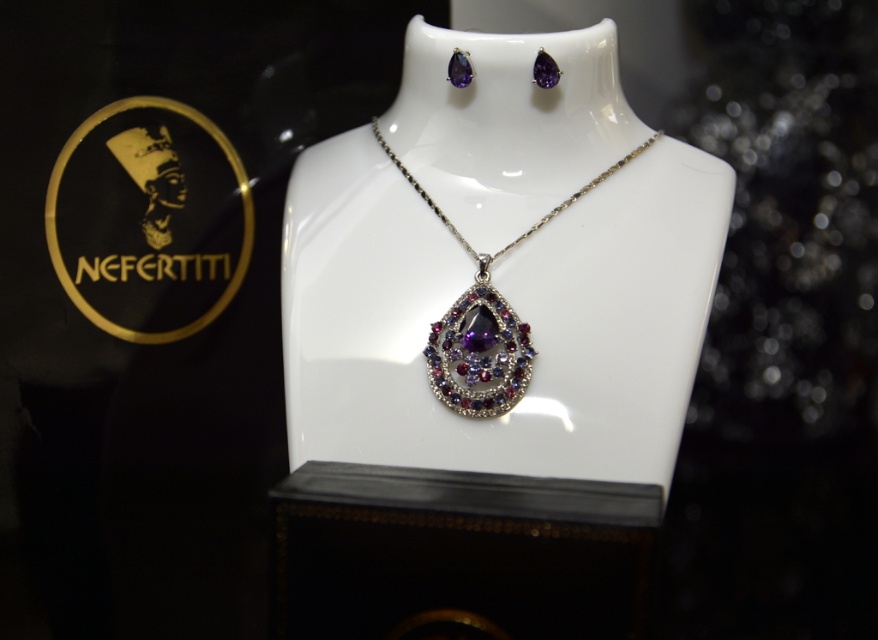
Question: Can you confirm if shiny silver necklace with purple gemstone at center is positioned to the right of amber purple gemstone at upper center?

Choices:
 (A) yes
 (B) no

Answer: (B)

Question: Which object is farther from the camera taking this photo?

Choices:
 (A) gold/engraved logo at upper left
 (B) amethyst gemstone at upper center
 (C) amber purple gemstone at upper center
 (D) shiny silver necklace with purple gemstone at center

Answer: (A)

Question: Which point is closer to the camera?

Choices:
 (A) click(558, 80)
 (B) click(458, 74)

Answer: (A)

Question: Among these points, which one is nearest to the camera?

Choices:
 (A) (538, 84)
 (B) (451, 68)
 (C) (138, 109)
 (D) (459, 304)

Answer: (D)

Question: Is the position of shiny silver necklace with purple gemstone at center less distant than that of amber purple gemstone at upper center?

Choices:
 (A) yes
 (B) no

Answer: (A)

Question: Is gold/engraved logo at upper left closer to camera compared to amethyst gemstone at upper center?

Choices:
 (A) yes
 (B) no

Answer: (B)